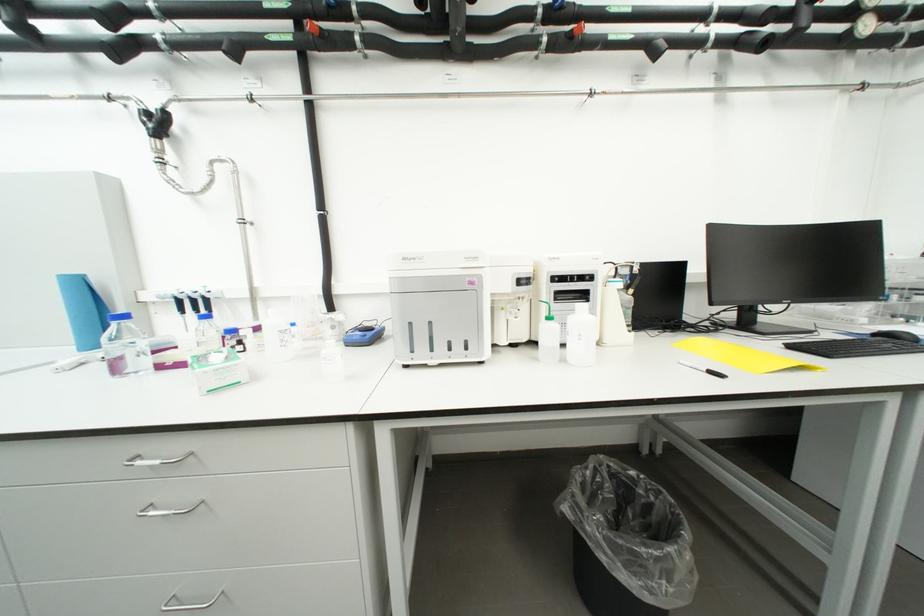
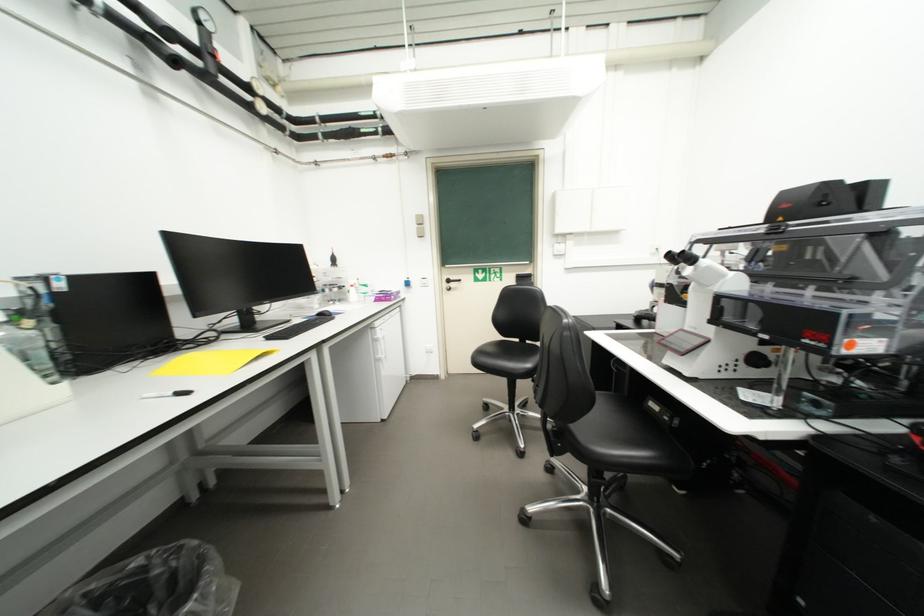
In the second image, find the point that corresponds to the point at 799,349 in the first image.

(276, 339)